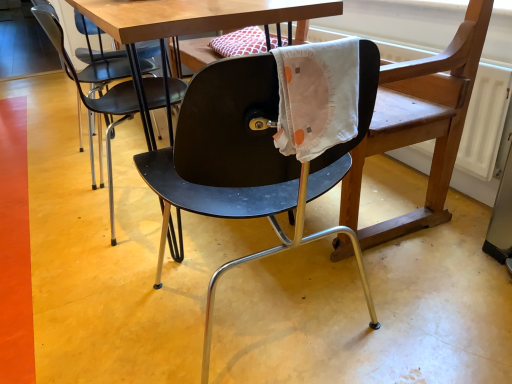
Question: Is matte black swivel chair at center oriented towards matte black chair at center, the second chair viewed from the left?

Choices:
 (A) yes
 (B) no

Answer: (A)

Question: Is matte black swivel chair at center thinner than matte black chair at center, marked as the 1th chair in a right-to-left arrangement?

Choices:
 (A) no
 (B) yes

Answer: (A)

Question: From a real-world perspective, is matte black swivel chair at center physically below matte black chair at center, marked as the 1th chair in a right-to-left arrangement?

Choices:
 (A) yes
 (B) no

Answer: (B)

Question: Is matte black swivel chair at center smaller than matte black chair at center, the second chair viewed from the left?

Choices:
 (A) yes
 (B) no

Answer: (B)

Question: Can you confirm if matte black swivel chair at center is bigger than matte black chair at center, marked as the 1th chair in a right-to-left arrangement?

Choices:
 (A) no
 (B) yes

Answer: (B)

Question: Is matte black swivel chair at center further to camera compared to matte black chair at center, the second chair viewed from the left?

Choices:
 (A) yes
 (B) no

Answer: (A)

Question: Can you confirm if matte black chair at center, marked as the 1th chair in a right-to-left arrangement, is bigger than matte black chair at center, acting as the second chair starting from the right?

Choices:
 (A) yes
 (B) no

Answer: (A)

Question: Is matte black chair at center, marked as the 1th chair in a right-to-left arrangement, wider than matte black chair at center, which appears as the 1th chair when viewed from the left?

Choices:
 (A) yes
 (B) no

Answer: (A)

Question: Is matte black chair at center, the second chair viewed from the left, oriented towards matte black chair at center, which appears as the 1th chair when viewed from the left?

Choices:
 (A) no
 (B) yes

Answer: (B)

Question: Is matte black chair at center, the second chair viewed from the left, located outside matte black chair at center, acting as the second chair starting from the right?

Choices:
 (A) no
 (B) yes

Answer: (B)

Question: Is matte black chair at center, marked as the 1th chair in a right-to-left arrangement, taller than matte black chair at center, acting as the second chair starting from the right?

Choices:
 (A) yes
 (B) no

Answer: (A)

Question: From a real-world perspective, does matte black chair at center, the second chair viewed from the left, sit lower than matte black chair at center, which appears as the 1th chair when viewed from the left?

Choices:
 (A) no
 (B) yes

Answer: (A)

Question: Would you say matte black chair at center, acting as the second chair starting from the right, is outside matte black chair at center, the second chair viewed from the left?

Choices:
 (A) no
 (B) yes

Answer: (B)